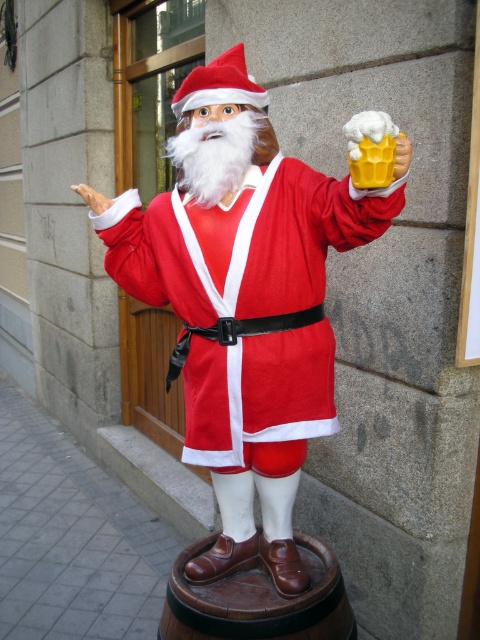
Is matte red santa claus at center shorter than yellow matte beer mug at upper center?

No.

Is point (216, 550) in front of point (398, 168)?

That is False.

The width and height of the screenshot is (480, 640). I want to click on matte red santa claus at center, so click(243, 304).

At what (x,y) coordinates should I click in order to perform the action: click on matte red santa claus at center. Please return your answer as a coordinate pair (x, y). Looking at the image, I should click on (243, 304).

Who is higher up, yellow matte beer mug at upper center or white matte hand at upper center?

A: white matte hand at upper center is higher up.

Which of these two, yellow matte beer mug at upper center or white matte hand at upper center, stands shorter?

yellow matte beer mug at upper center is shorter.

Measure the distance between yellow matte beer mug at upper center and camera.

yellow matte beer mug at upper center is 1.05 meters away from camera.

Find the location of a particular element. The height and width of the screenshot is (640, 480). yellow matte beer mug at upper center is located at coordinates (402, 156).

Between matte red santa claus at center and white matte hand at upper center, which one appears on the left side from the viewer's perspective?

From the viewer's perspective, white matte hand at upper center appears more on the left side.

Is matte red santa claus at center wider than white matte hand at upper center?

Yes.

This screenshot has height=640, width=480. Identify the location of matte red santa claus at center. [x=243, y=304].